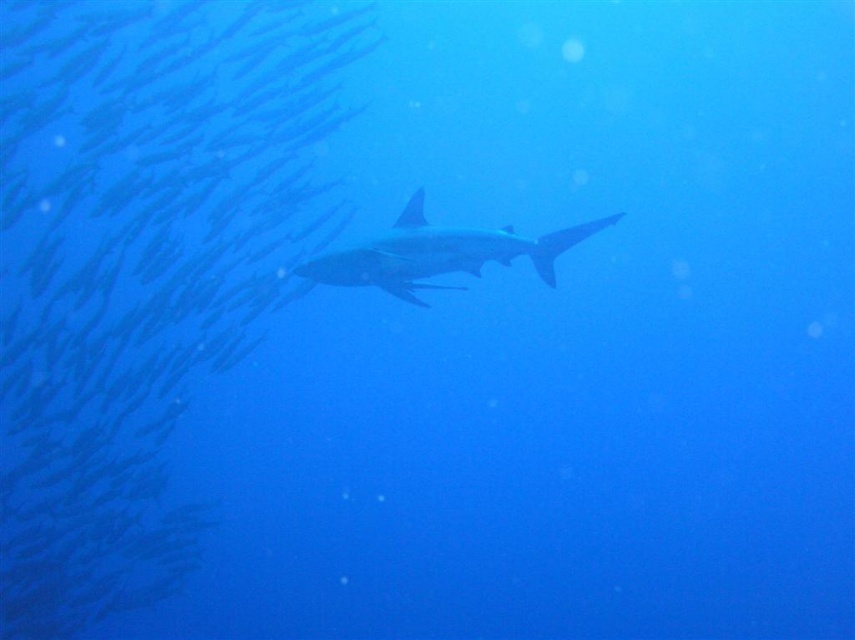
Is translucent blue fish at upper left thinner than smooth gray shark at center?

No, translucent blue fish at upper left is not thinner than smooth gray shark at center.

Between translucent blue fish at upper left and smooth gray shark at center, which one has less height?

smooth gray shark at center

The width and height of the screenshot is (855, 640). I want to click on translucent blue fish at upper left, so click(x=140, y=269).

I want to click on translucent blue fish at upper left, so click(140, 269).